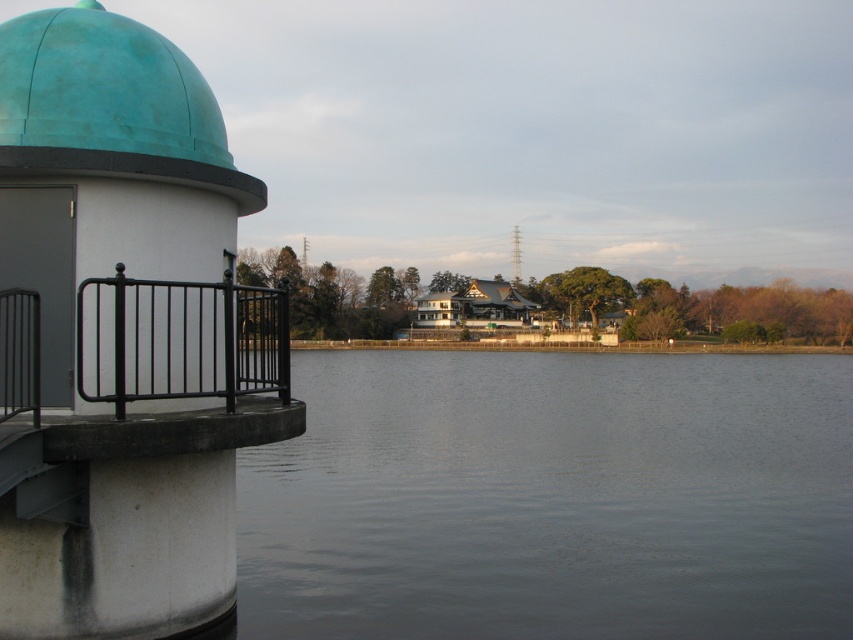
You are standing at the lakeside and want to take a photo of both the teal matte dome at upper left and the metallic gray tower at center. Which object should you position closer to the left side of your camera frame to include both in the photo?

The teal matte dome at upper left is to the left of the metallic gray tower at center, so you should position the teal matte dome at upper left closer to the left side of your camera frame to include both in the photo.

Based on the photo, you are a landscape architect designing a new park layout. You need to place a new bench between the teal matte dome at upper left and the metallic gray tower at center. Based on their sizes, which object should the bench be closer to?

The teal matte dome at upper left occupies less space than the metallic gray tower at center, so the bench should be placed closer to the teal matte dome at upper left to balance the visual weight between the two structures.